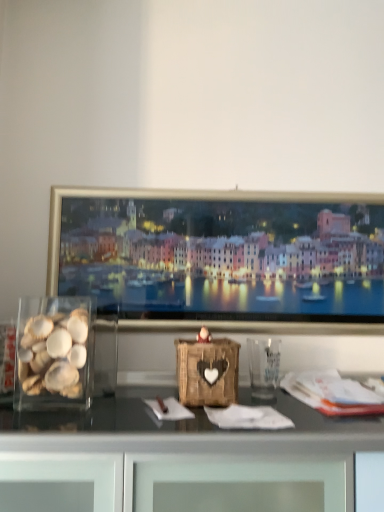
Question: Based on their sizes in the image, would you say translucent glass shells at left is bigger or smaller than transparent plastic glass at center?

Choices:
 (A) big
 (B) small

Answer: (A)

Question: Considering their positions, is translucent glass shells at left located in front of or behind transparent plastic glass at center?

Choices:
 (A) front
 (B) behind

Answer: (A)

Question: Is translucent glass shells at left to the left or to the right of transparent plastic glass at center in the image?

Choices:
 (A) left
 (B) right

Answer: (A)

Question: Considering the positions of transparent plastic glass at center and translucent glass shells at left in the image, is transparent plastic glass at center wider or thinner than translucent glass shells at left?

Choices:
 (A) thin
 (B) wide

Answer: (A)

Question: Would you say transparent plastic glass at center is inside or outside translucent glass shells at left?

Choices:
 (A) inside
 (B) outside

Answer: (B)

Question: From a real-world perspective, relative to translucent glass shells at left, is transparent plastic glass at center vertically above or below?

Choices:
 (A) below
 (B) above

Answer: (A)

Question: Considering the positions of transparent plastic glass at center and translucent glass shells at left in the image, is transparent plastic glass at center taller or shorter than translucent glass shells at left?

Choices:
 (A) tall
 (B) short

Answer: (B)